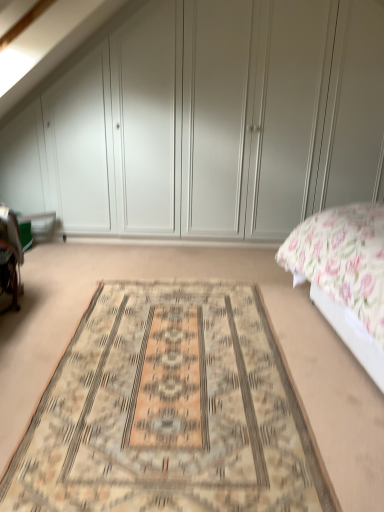
You are a GUI agent. You are given a task and a screenshot of the screen. Output one action in this format:
    pyautogui.click(x=<x>, y=<y>)
    Task: Click on the free region under beige woven rug at center (from a real-world perspective)
    The width and height of the screenshot is (384, 512).
    Given the screenshot: What is the action you would take?
    pyautogui.click(x=196, y=371)